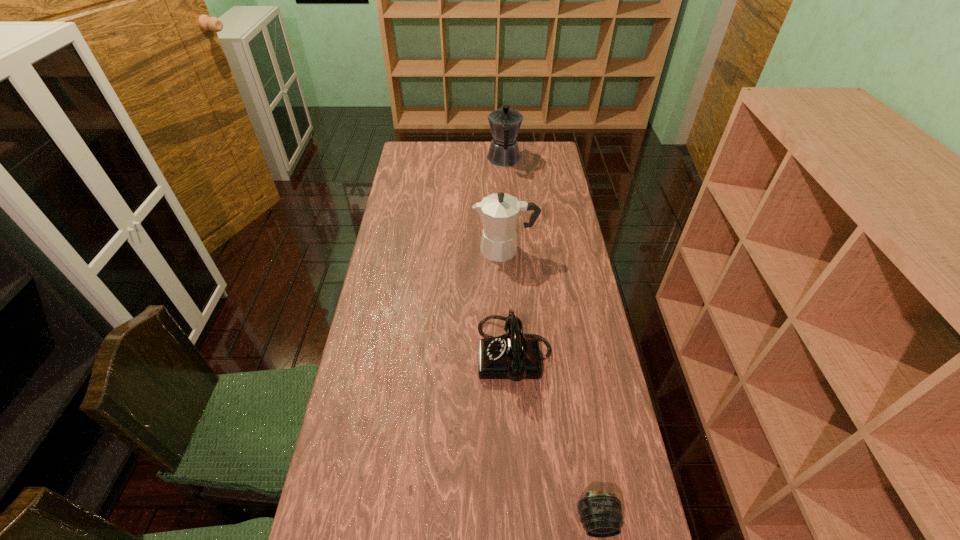
The image size is (960, 540). What are the coordinates of `free space located 0.310m on the dial of the second shortest object` in the screenshot? It's located at (375, 354).

Identify the location of free space located 0.110m on the dial of the second shortest object. The height and width of the screenshot is (540, 960). (442, 354).

This screenshot has width=960, height=540. What are the coordinates of `object that is at the far edge` in the screenshot? It's located at (505, 123).

Where is `telephone that is at the right edge`? telephone that is at the right edge is located at coordinates (513, 356).

Where is `telephoto lens at the right edge`? The width and height of the screenshot is (960, 540). telephoto lens at the right edge is located at coordinates (600, 512).

In the image, there is a desktop. Identify the location of free region at the far edge. Image resolution: width=960 pixels, height=540 pixels. (454, 146).

This screenshot has width=960, height=540. Identify the location of free space at the left edge. (399, 387).

What are the coordinates of `vacant space at the right edge` in the screenshot? It's located at (598, 349).

Locate an element on the screen. This screenshot has height=540, width=960. vacant space at the far left corner is located at coordinates (399, 165).

Where is `free location at the far right corner of the desktop`? free location at the far right corner of the desktop is located at coordinates (527, 149).